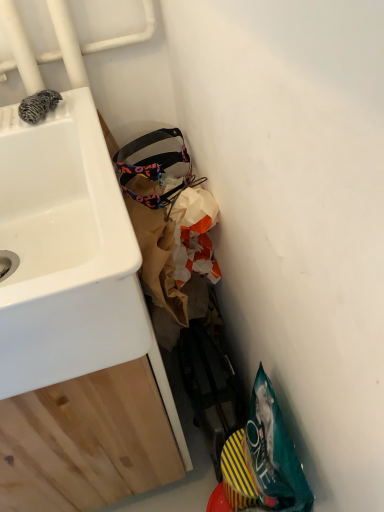
Image resolution: width=384 pixels, height=512 pixels. In order to click on white glossy sink at upper left in this screenshot , I will do coord(65,252).

Describe the element at coordinates (65, 252) in the screenshot. I see `white glossy sink at upper left` at that location.

Measure the distance between white glossy sink at upper left and camera.

white glossy sink at upper left is 46.95 centimeters away from camera.

This screenshot has height=512, width=384. Identify the location of white glossy sink at upper left. (65, 252).